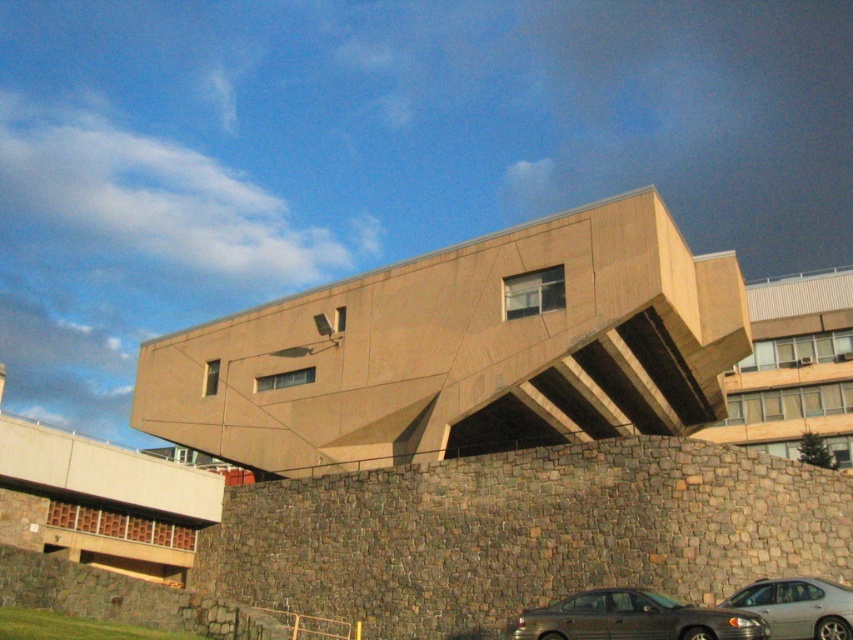
Does beige stone building at upper center have a greater width compared to metallic gray sedan at lower right?

Yes, beige stone building at upper center is wider than metallic gray sedan at lower right.

Is point (811, 390) closer to viewer compared to point (654, 616)?

No, (811, 390) is further to viewer.

This screenshot has height=640, width=853. Find the location of `beige stone building at upper center`. beige stone building at upper center is located at coordinates pyautogui.click(x=793, y=368).

You are a GUI agent. You are given a task and a screenshot of the screen. Output one action in this format:
    pyautogui.click(x=<x>, y=<y>)
    Task: Click on the beige stone building at upper center
    This screenshot has width=853, height=640.
    Given the screenshot: What is the action you would take?
    pyautogui.click(x=793, y=368)

Which is below, beige concrete building at center or silver metallic sedan at lower right?

Positioned lower is silver metallic sedan at lower right.

Does beige concrete building at center have a smaller size compared to silver metallic sedan at lower right?

No.

Find the location of `beige concrete building at center`. beige concrete building at center is located at coordinates (463, 349).

Locate an element on the screen. The image size is (853, 640). beige concrete building at center is located at coordinates (463, 349).

Who is more distant from viewer, (x=851, y=442) or (x=785, y=602)?

The point (x=851, y=442) is more distant.

Does point (728, 381) lie behind point (747, 584)?

Yes, point (728, 381) is behind point (747, 584).

The width and height of the screenshot is (853, 640). I want to click on beige stone building at upper center, so click(793, 368).